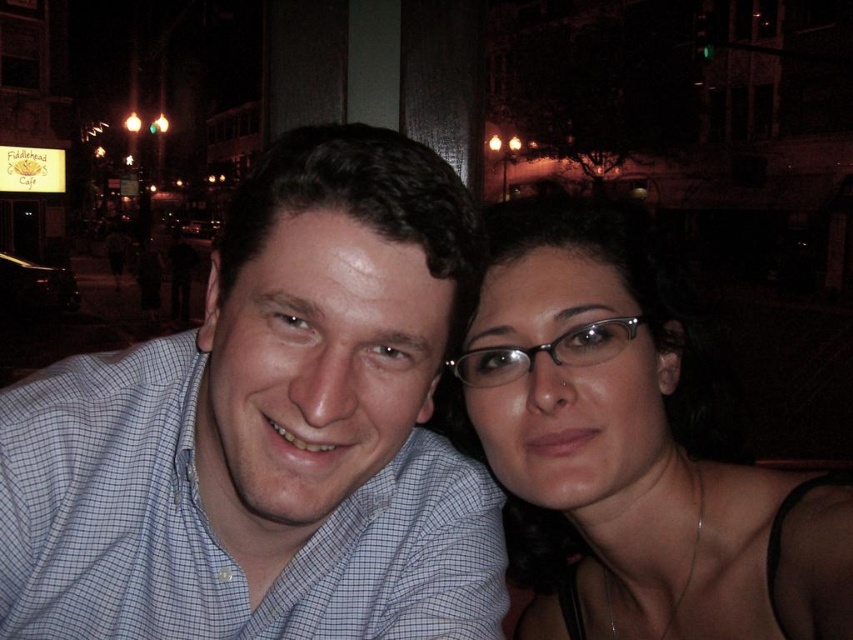
Question: Can you confirm if matte black hair at right is bigger than metallic frame glasses at center?

Choices:
 (A) no
 (B) yes

Answer: (B)

Question: Is matte black hair at right behind metallic frame glasses at center?

Choices:
 (A) yes
 (B) no

Answer: (B)

Question: Which of the following is the farthest from the observer?

Choices:
 (A) (628, 550)
 (B) (593, 346)
 (C) (149, 390)

Answer: (A)

Question: Is blue checkered shirt at center to the right of metallic frame glasses at center from the viewer's perspective?

Choices:
 (A) no
 (B) yes

Answer: (A)

Question: Which of the following is the farthest from the observer?

Choices:
 (A) metallic frame glasses at center
 (B) blue checkered shirt at center
 (C) matte black hair at right

Answer: (A)

Question: Which of the following is the closest to the observer?

Choices:
 (A) (635, 392)
 (B) (601, 353)
 (C) (419, 154)

Answer: (C)